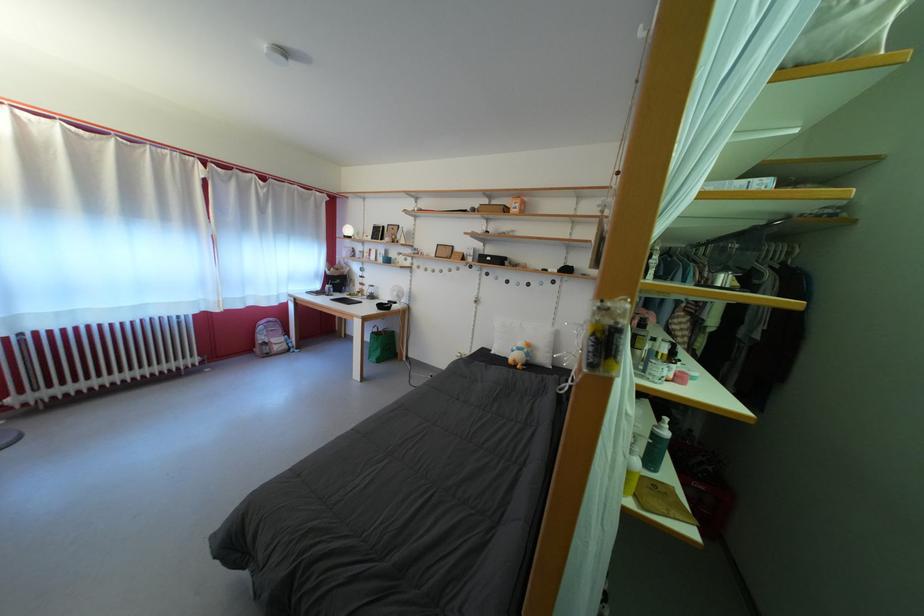
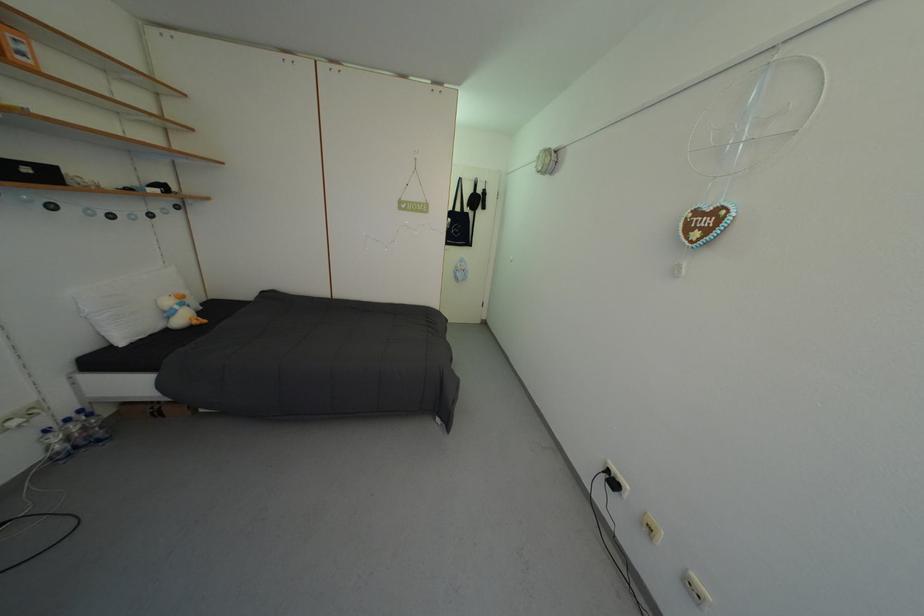
Locate, in the second image, the point that corresponds to point 524,214 in the first image.

(30, 60)